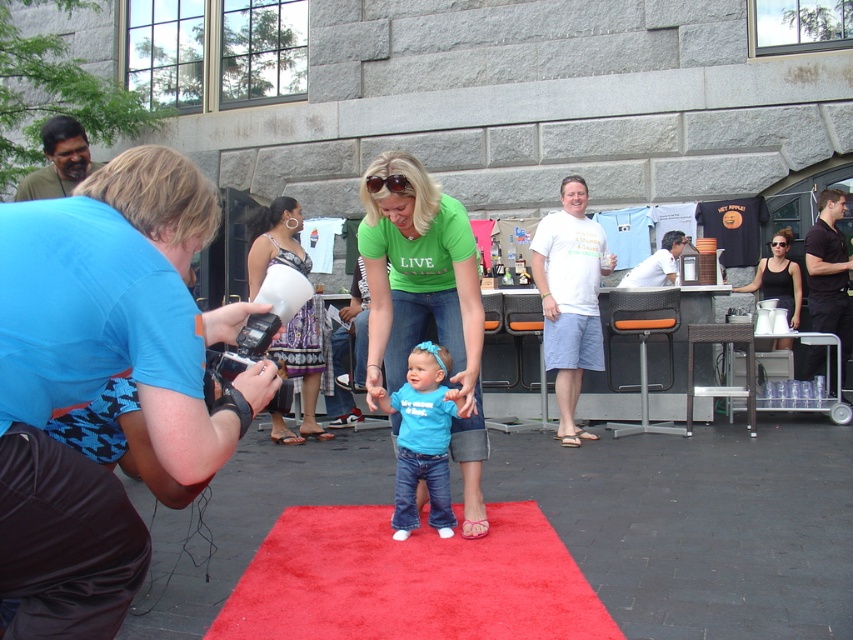
You are standing at the point marked as point (103, 380) in the image. What object is located exactly at this point?

The blue fabric camera at left is located exactly at point (103, 380).

You are a photographer who needs to set up a blue fabric camera at left to capture the scene from a distance. The camera requires a minimum of 1.5 meters of space between it and the shiny red carpet at center to avoid distortion. Is the current distance sufficient?

The blue fabric camera at left and shiny red carpet at center are 1.33 meters apart from each other. Since the required minimum distance is 1.5 meters, the current distance is insufficient to avoid distortion.